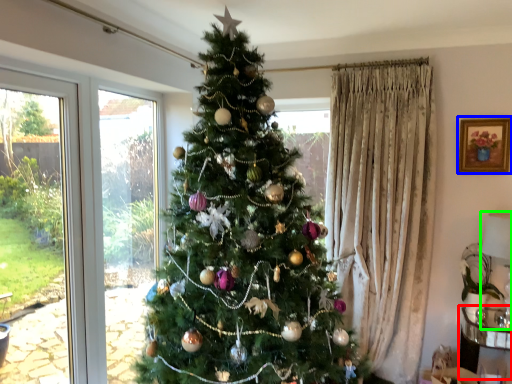
Question: Which object is positioned farthest from furniture (highlighted by a red box)? Select from picture frame (highlighted by a blue box) and lamp (highlighted by a green box).

Choices:
 (A) picture frame
 (B) lamp

Answer: (A)